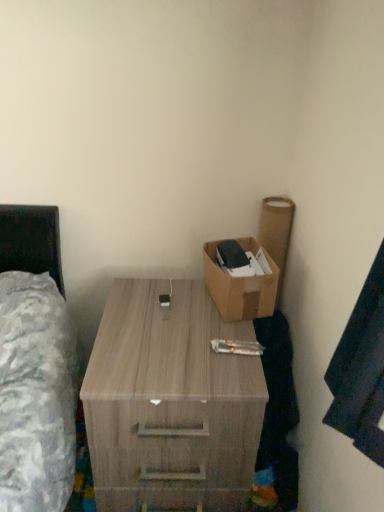
Where is `free point above wooden desk at center (from a real-world perspective)`? The width and height of the screenshot is (384, 512). free point above wooden desk at center (from a real-world perspective) is located at coordinates (162, 328).